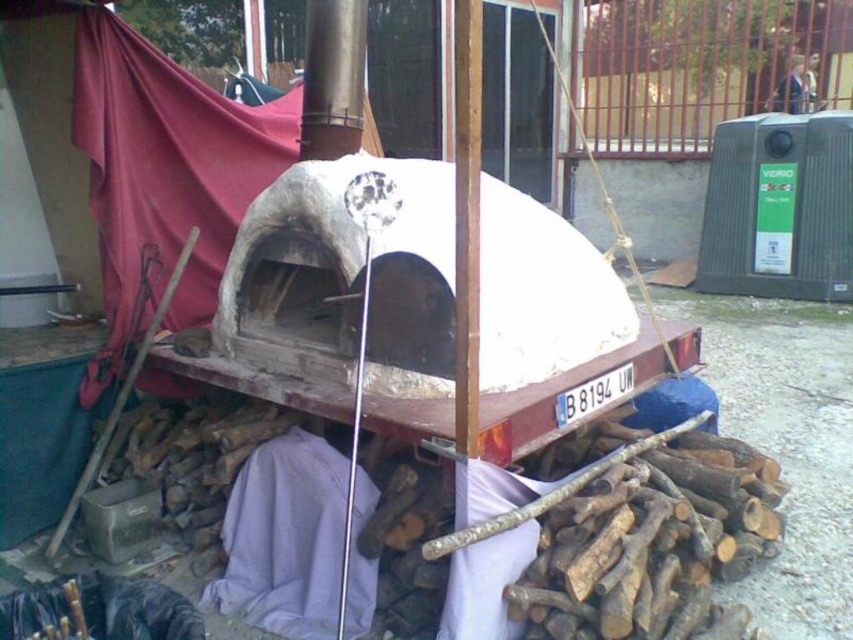
Is purple fabric at center taller than blue denim jacket at upper right?

No, purple fabric at center is not taller than blue denim jacket at upper right.

Identify the location of purple fabric at center. (285, 538).